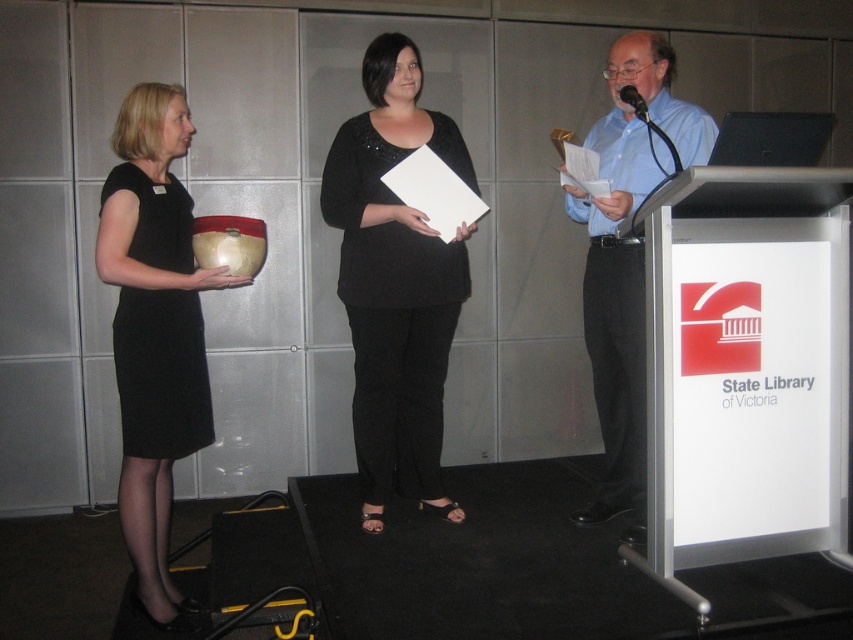
Question: Considering the real-world distances, which object is closest to the matte black dress at left?

Choices:
 (A) black matte dress at center
 (B) black matte dress at left
 (C) black plastic microphone at upper right

Answer: (B)

Question: Which object is closer to the camera taking this photo?

Choices:
 (A) matte black dress at left
 (B) black matte dress at center
 (C) black plastic microphone at upper right
 (D) blue shirt at right

Answer: (A)

Question: From the image, what is the correct spatial relationship of black matte dress at left in relation to black plastic microphone at upper right?

Choices:
 (A) below
 (B) above

Answer: (A)

Question: Based on their relative distances, which object is nearer to the black matte dress at center?

Choices:
 (A) matte black dress at left
 (B) blue shirt at right
 (C) black matte dress at left

Answer: (B)

Question: Is black matte dress at center above black plastic microphone at upper right?

Choices:
 (A) no
 (B) yes

Answer: (A)

Question: Does matte black dress at left have a lesser width compared to blue shirt at right?

Choices:
 (A) no
 (B) yes

Answer: (A)